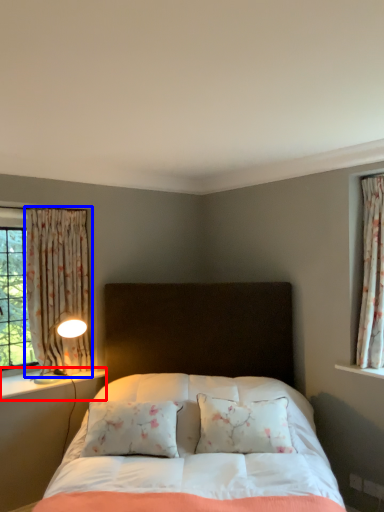
Question: Which of the following is the farthest to the observer, window sill (highlighted by a red box) or curtain (highlighted by a blue box)?

Choices:
 (A) window sill
 (B) curtain

Answer: (B)